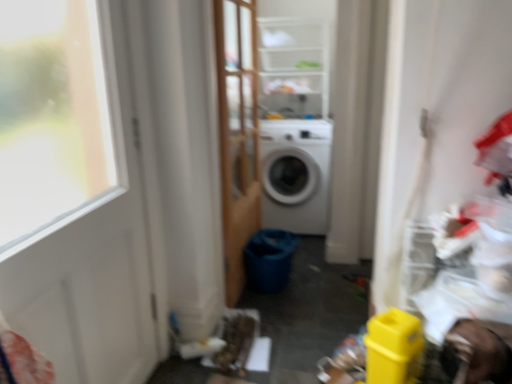
Question: Is clear plastic shelves at upper center spatially inside white matte washing machine at center, or outside of it?

Choices:
 (A) inside
 (B) outside

Answer: (B)

Question: Considering their positions, is clear plastic shelves at upper center located in front of or behind white matte washing machine at center?

Choices:
 (A) behind
 (B) front

Answer: (B)

Question: Which object is the farthest from the clear plastic shelves at upper center?

Choices:
 (A) white matte door at left
 (B) white matte washing machine at center
 (C) wooden screen door at center

Answer: (A)

Question: Which object is positioned closest to the wooden screen door at center?

Choices:
 (A) white matte door at left
 (B) white matte washing machine at center
 (C) clear plastic shelves at upper center

Answer: (B)